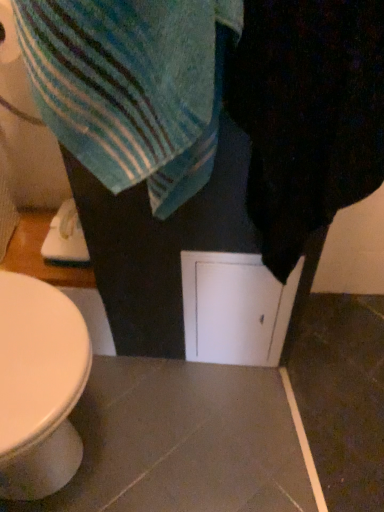
Question: In terms of width, does blue striped towel at upper left look wider or thinner when compared to white matte screen door at center?

Choices:
 (A) wide
 (B) thin

Answer: (A)

Question: Relative to white matte screen door at center, is blue striped towel at upper left in front or behind?

Choices:
 (A) behind
 (B) front

Answer: (B)

Question: Estimate the real-world distances between objects in this image. Which object is farther from the white matte screen door at center?

Choices:
 (A) blue striped towel at upper left
 (B) black fuzzy towel at right

Answer: (A)

Question: Estimate the real-world distances between objects in this image. Which object is closer to the blue striped towel at upper left?

Choices:
 (A) black fuzzy towel at right
 (B) white matte screen door at center

Answer: (A)